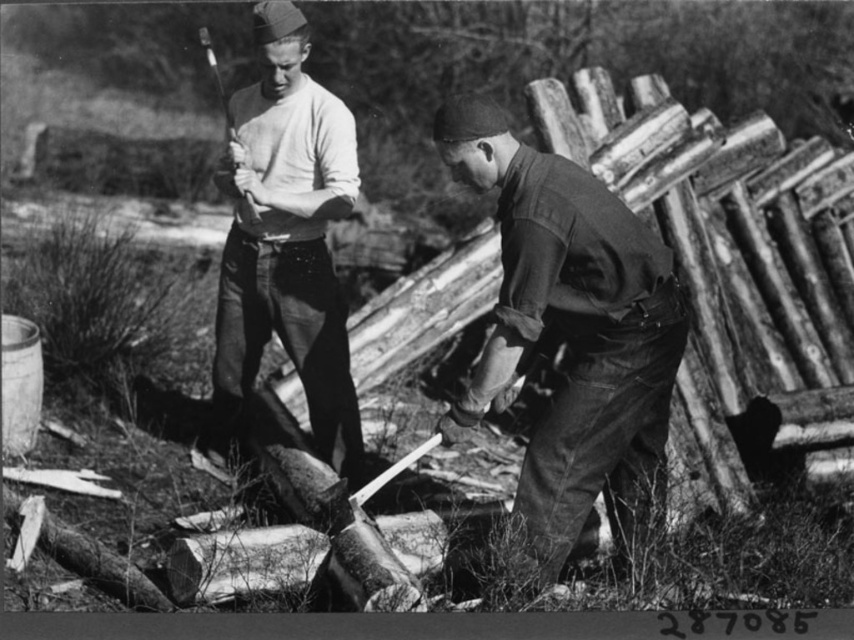
Can you confirm if dark green uniform at center is taller than white matte shirt at center?

Incorrect, dark green uniform at center's height is not larger of white matte shirt at center's.

Between dark green uniform at center and white matte shirt at center, which one appears on the left side from the viewer's perspective?

Positioned to the left is white matte shirt at center.

Is point (500, 376) positioned in front of point (291, 339)?

Yes.

You are a GUI agent. You are given a task and a screenshot of the screen. Output one action in this format:
    pyautogui.click(x=<x>, y=<y>)
    Task: Click on the dark green uniform at center
    
    Given the screenshot: What is the action you would take?
    pyautogui.click(x=570, y=336)

I want to click on white matte shirt at center, so click(284, 241).

The height and width of the screenshot is (640, 854). What do you see at coordinates (284, 241) in the screenshot? I see `white matte shirt at center` at bounding box center [284, 241].

This screenshot has height=640, width=854. What are the coordinates of `white matte shirt at center` in the screenshot? It's located at (284, 241).

Which of these two, dark green uniform at center or smooth wood ax at upper center, stands taller?

Standing taller between the two is smooth wood ax at upper center.

Between dark green uniform at center and smooth wood ax at upper center, which one has less height?

With less height is dark green uniform at center.

The height and width of the screenshot is (640, 854). Find the location of `dark green uniform at center`. dark green uniform at center is located at coordinates (570, 336).